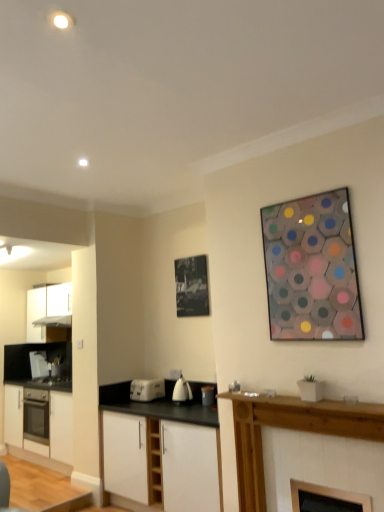
Describe the element at coordinates (39, 364) in the screenshot. This screenshot has width=384, height=512. I see `white plastic toaster at left, marked as the 1th appliance in a back-to-front arrangement` at that location.

What is the approximate height of white plastic toaster at left, the 3th appliance positioned from the front?

white plastic toaster at left, the 3th appliance positioned from the front, is 15.46 inches in height.

What do you see at coordinates (162, 462) in the screenshot?
I see `white matte cabinet at lower center, acting as the third cabinetry starting from the back` at bounding box center [162, 462].

Locate an element on the screen. satin silver exhaust hood at left is located at coordinates (54, 321).

Measure the distance between wooden fireplace at lower right, the 4th cabinetry viewed from the back, and camera.

A distance of 2.33 meters exists between wooden fireplace at lower right, the 4th cabinetry viewed from the back, and camera.

What do you see at coordinates (291, 429) in the screenshot? The image size is (384, 512). I see `wooden fireplace at lower right, the 4th cabinetry viewed from the back` at bounding box center [291, 429].

You are a GUI agent. You are given a task and a screenshot of the screen. Output one action in this format:
    pyautogui.click(x=<x>, y=<y>)
    Task: Click on the white plastic toaster at left, marked as the 1th appliance in a left-to-right arrangement
    
    Given the screenshot: What is the action you would take?
    pyautogui.click(x=39, y=364)

Is white glossy kettle at center, acting as the first kitchen appliance starting from the front, in front of or behind white plastic toaster at left, the 3th appliance positioned from the front, in the image?

Clearly, white glossy kettle at center, acting as the first kitchen appliance starting from the front, is in front of white plastic toaster at left, the 3th appliance positioned from the front.

Considering the points (185, 390) and (45, 356), which point is in front, point (185, 390) or point (45, 356)?

Point (185, 390)

Is white glossy kettle at center, acting as the first kitchen appliance starting from the front, facing away from white plastic toaster at left, the third appliance from the right?

No, white glossy kettle at center, acting as the first kitchen appliance starting from the front, is not facing away from white plastic toaster at left, the third appliance from the right.

Which is behind, point (334, 506) or point (323, 208)?

The point (323, 208) is more distant.

Based on their sizes in the image, would you say black glass fireplace at lower center, the 1th appliance positioned from the right, is bigger or smaller than metallic hexagon art at upper right, the 2th picture frame in the left-to-right sequence?

Clearly, black glass fireplace at lower center, the 1th appliance positioned from the right, is smaller in size than metallic hexagon art at upper right, the 2th picture frame in the left-to-right sequence.

Could you measure the distance between black glass fireplace at lower center, positioned as the 3th appliance in back-to-front order, and metallic hexagon art at upper right, the 2th picture frame in the left-to-right sequence?

black glass fireplace at lower center, positioned as the 3th appliance in back-to-front order, and metallic hexagon art at upper right, the 2th picture frame in the left-to-right sequence, are 4.01 feet apart.

From a real-world perspective, count 3rd appliances downward from the metallic hexagon art at upper right, which ranks as the first picture frame in front-to-back order, and point to it. Please provide its 2D coordinates.

[(326, 499)]

In terms of width, does black glass fireplace at lower center, marked as the first appliance in a front-to-back arrangement, look wider or thinner when compared to wooden fireplace at lower right, positioned as the fourth cabinetry in left-to-right order?

Clearly, black glass fireplace at lower center, marked as the first appliance in a front-to-back arrangement, has less width compared to wooden fireplace at lower right, positioned as the fourth cabinetry in left-to-right order.

Is black glass fireplace at lower center, the 3th appliance positioned from the left, to the left or to the right of wooden fireplace at lower right, positioned as the fourth cabinetry in left-to-right order, in the image?

From the image, it's evident that black glass fireplace at lower center, the 3th appliance positioned from the left, is to the right of wooden fireplace at lower right, positioned as the fourth cabinetry in left-to-right order.

Is black glass fireplace at lower center, the 3th appliance positioned from the left, spatially inside wooden fireplace at lower right, which appears as the first cabinetry when viewed from the right, or outside of it?

black glass fireplace at lower center, the 3th appliance positioned from the left, is spatially positioned inside wooden fireplace at lower right, which appears as the first cabinetry when viewed from the right.

From the black glass fireplace at lower center, the 1th appliance positioned from the right, count the 1st cabinetry to the left and point to it. Please provide its 2D coordinates.

[(291, 429)]

Does metallic silver toaster at center, the second appliance in the back-to-front sequence, have a lesser width compared to white glossy cabinets at left, the 2th cabinetry when ordered from left to right?

Yes.

Between metallic silver toaster at center, the second appliance in the back-to-front sequence, and white glossy cabinets at left, the 2th cabinetry when ordered from left to right, which one has less height?

Standing shorter between the two is metallic silver toaster at center, the second appliance in the back-to-front sequence.

From the white glossy cabinets at left, the 2th cabinetry when ordered from left to right, count 1st appliance to the right and point to it. Please provide its 2D coordinates.

[(207, 395)]

From a real-world perspective, between white glossy cabinets at left, the first cabinetry viewed from the back, and black paper at upper center, which appears as the first picture frame when viewed from the back, who is vertically higher?

In real-world perspective, black paper at upper center, which appears as the first picture frame when viewed from the back, is above.

Considering the sizes of white glossy cabinets at left, which appears as the 3th cabinetry when viewed from the right, and black paper at upper center, which appears as the first picture frame when viewed from the back, in the image, is white glossy cabinets at left, which appears as the 3th cabinetry when viewed from the right, bigger or smaller than black paper at upper center, which appears as the first picture frame when viewed from the back,?

Clearly, white glossy cabinets at left, which appears as the 3th cabinetry when viewed from the right, is larger in size than black paper at upper center, which appears as the first picture frame when viewed from the back.

Is point (71, 308) more distant than point (191, 303)?

Yes, point (71, 308) is farther from viewer.

Considering the relative sizes of white glossy kettle at center, acting as the first kitchen appliance starting from the front, and black paper at upper center, positioned as the first picture frame in left-to-right order, in the image provided, is white glossy kettle at center, acting as the first kitchen appliance starting from the front, taller than black paper at upper center, positioned as the first picture frame in left-to-right order,?

Incorrect, the height of white glossy kettle at center, acting as the first kitchen appliance starting from the front, is not larger of that of black paper at upper center, positioned as the first picture frame in left-to-right order.

Is white glossy kettle at center, positioned as the 2th kitchen appliance in left-to-right order, next to black paper at upper center, which appears as the first picture frame when viewed from the back?

No, white glossy kettle at center, positioned as the 2th kitchen appliance in left-to-right order, is not making contact with black paper at upper center, which appears as the first picture frame when viewed from the back.

Is white glossy kettle at center, positioned as the 2th kitchen appliance in left-to-right order, spatially inside black paper at upper center, which appears as the first picture frame when viewed from the back, or outside of it?

white glossy kettle at center, positioned as the 2th kitchen appliance in left-to-right order, is outside black paper at upper center, which appears as the first picture frame when viewed from the back.

Is white glossy kettle at center, the 2th kitchen appliance positioned from the back, facing away from black paper at upper center, positioned as the first picture frame in left-to-right order?

No, white glossy kettle at center, the 2th kitchen appliance positioned from the back,'s orientation is not away from black paper at upper center, positioned as the first picture frame in left-to-right order.

Is white matte cabinet at lower center, the second cabinetry in the right-to-left sequence, at the back of black glass fireplace at lower center, the 1th appliance positioned from the right?

No, black glass fireplace at lower center, the 1th appliance positioned from the right,'s orientation is not away from white matte cabinet at lower center, the second cabinetry in the right-to-left sequence.

How different are the orientations of black glass fireplace at lower center, positioned as the 3th appliance in back-to-front order, and white matte cabinet at lower center, which ranks as the 3th cabinetry in left-to-right order, in degrees?

black glass fireplace at lower center, positioned as the 3th appliance in back-to-front order, and white matte cabinet at lower center, which ranks as the 3th cabinetry in left-to-right order, are facing 0.305 degrees away from each other.

Is black glass fireplace at lower center, the 3th appliance positioned from the left, thinner than white matte cabinet at lower center, which ranks as the 3th cabinetry in left-to-right order?

Indeed, black glass fireplace at lower center, the 3th appliance positioned from the left, has a lesser width compared to white matte cabinet at lower center, which ranks as the 3th cabinetry in left-to-right order.

This screenshot has width=384, height=512. I want to click on kitchen appliance that is the 2nd one when counting upward from the white plastic toaster at left, marked as the 1th appliance in a back-to-front arrangement (from the image's perspective), so click(182, 391).

Which picture frame is the 1st one when counting from the left side of the black glass fireplace at lower center, marked as the first appliance in a front-to-back arrangement? Please provide its 2D coordinates.

[(312, 269)]

Consider the image. Looking at the image, which one is located further to white matte cabinet at lower center, the second cabinetry in the right-to-left sequence, metallic hexagon art at upper right, acting as the second picture frame starting from the back, or white plastic toaster at lower center, positioned as the 1th kitchen appliance in left-to-right order?

Based on the image, metallic hexagon art at upper right, acting as the second picture frame starting from the back, appears to be further to white matte cabinet at lower center, the second cabinetry in the right-to-left sequence.

Looking at the image, which one is located further to black glass fireplace at lower center, the 1th appliance positioned from the right, white plastic toaster at left, marked as the 1th appliance in a back-to-front arrangement, or white matte cabinet at lower center, which ranks as the 3th cabinetry in left-to-right order?

Among the two, white plastic toaster at left, marked as the 1th appliance in a back-to-front arrangement, is located further to black glass fireplace at lower center, the 1th appliance positioned from the right.

When comparing their distances from wooden fireplace at lower right, which appears as the first cabinetry when viewed from the right, does black paper at upper center, which appears as the first picture frame when viewed from the back, or white glossy cabinets at left, the 2th cabinetry when ordered from left to right, seem further?

Among the two, white glossy cabinets at left, the 2th cabinetry when ordered from left to right, is located further to wooden fireplace at lower right, which appears as the first cabinetry when viewed from the right.

Considering their positions, is white glossy kettle at center, acting as the first kitchen appliance starting from the front, positioned closer to white glossy cabinets at left, marked as the fourth cabinetry in a front-to-back arrangement, than white matte cabinet at left, which is counted as the 1th cabinetry, starting from the left?

white matte cabinet at left, which is counted as the 1th cabinetry, starting from the left, lies closer to white glossy cabinets at left, marked as the fourth cabinetry in a front-to-back arrangement, than the other object.

Which object lies further to the anchor point white plastic toaster at lower center, positioned as the 1th kitchen appliance in left-to-right order, white matte cabinet at lower center, acting as the third cabinetry starting from the back, or white glossy kettle at center, positioned as the 2th kitchen appliance in left-to-right order?

white matte cabinet at lower center, acting as the third cabinetry starting from the back.

From the picture: Estimate the real-world distances between objects in this image. Which object is closer to metallic hexagon art at upper right, which ranks as the first picture frame in right-to-left order, white matte cabinet at left, placed as the second cabinetry when sorted from back to front, or white plastic toaster at left, the third appliance from the right?

white matte cabinet at left, placed as the second cabinetry when sorted from back to front, is positioned closer to the anchor metallic hexagon art at upper right, which ranks as the first picture frame in right-to-left order.

When comparing their distances from metallic silver toaster at center, the 2th appliance positioned from the front, does white glossy kettle at center, the first kitchen appliance from the right, or black glass fireplace at lower center, marked as the first appliance in a front-to-back arrangement, seem further?

Among the two, black glass fireplace at lower center, marked as the first appliance in a front-to-back arrangement, is located further to metallic silver toaster at center, the 2th appliance positioned from the front.

When comparing their distances from metallic hexagon art at upper right, which ranks as the first picture frame in front-to-back order, does white matte cabinet at lower center, which ranks as the 3th cabinetry in left-to-right order, or white glossy cabinets at left, marked as the fourth cabinetry in a front-to-back arrangement, seem closer?

The object closer to metallic hexagon art at upper right, which ranks as the first picture frame in front-to-back order, is white matte cabinet at lower center, which ranks as the 3th cabinetry in left-to-right order.

The height and width of the screenshot is (512, 384). In order to click on picture frame located between white matte cabinet at lower center, which ranks as the 3th cabinetry in left-to-right order, and white glossy cabinets at left, the first cabinetry viewed from the back, in the depth direction in this screenshot , I will do `click(192, 286)`.

Where is `appliance located between white glossy cabinets at left, marked as the fourth cabinetry in a front-to-back arrangement, and metallic hexagon art at upper right, the 2th picture frame in the left-to-right sequence, in the left-right direction`? This screenshot has width=384, height=512. appliance located between white glossy cabinets at left, marked as the fourth cabinetry in a front-to-back arrangement, and metallic hexagon art at upper right, the 2th picture frame in the left-to-right sequence, in the left-right direction is located at coordinates (207, 395).

At what (x,y) coordinates should I click in order to perform the action: click on appliance between white matte cabinet at left, which is the third cabinetry from front to back, and wooden fireplace at lower right, which ranks as the 1th cabinetry in front-to-back order, from left to right. Please return your answer as a coordinate pair (x, y). Image resolution: width=384 pixels, height=512 pixels. Looking at the image, I should click on (207, 395).

The height and width of the screenshot is (512, 384). In order to click on exhaust hood situated between white glossy cabinets at left, marked as the fourth cabinetry in a front-to-back arrangement, and white glossy kettle at center, the 2th kitchen appliance positioned from the back, from left to right in this screenshot , I will do `click(54, 321)`.